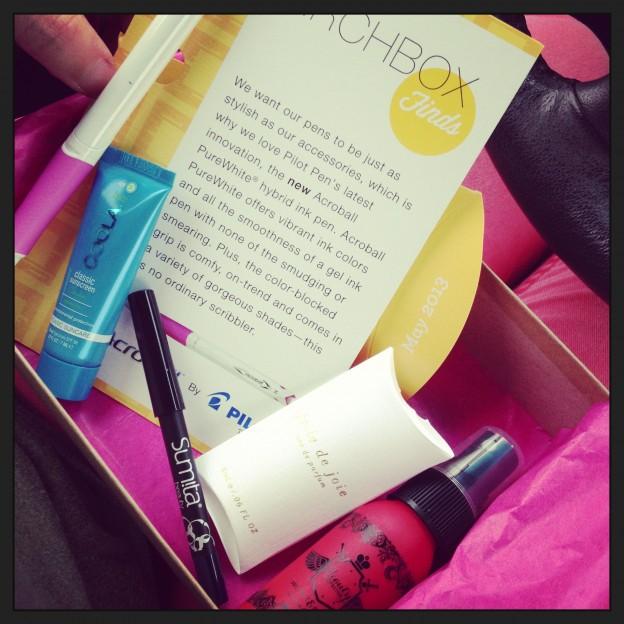
You are a GUI agent. You are given a task and a screenshot of the screen. Output one action in this format:
    pyautogui.click(x=<x>, y=<y>)
    Task: Click on the box
    This screenshot has width=624, height=624.
    Given the screenshot: What is the action you would take?
    pyautogui.click(x=535, y=382)